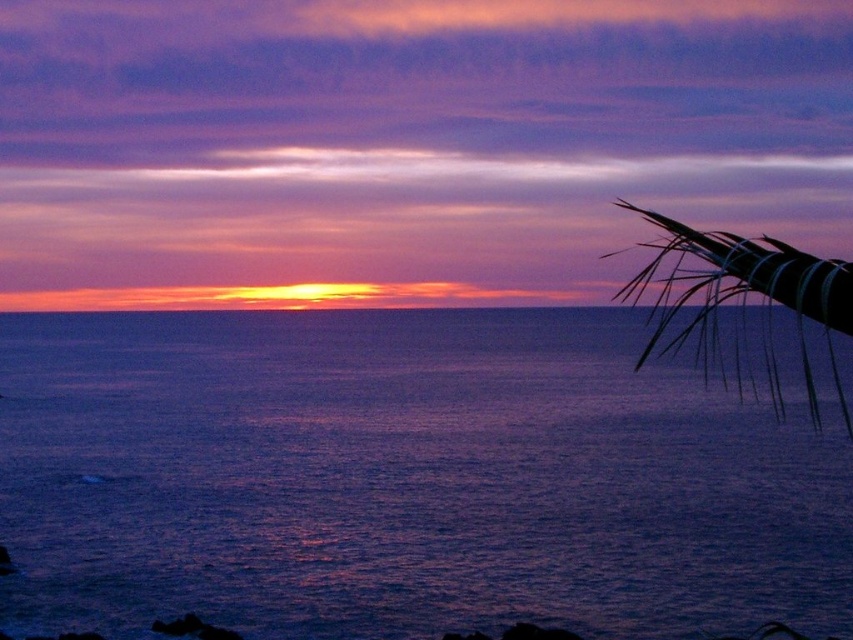
You are a photographer trying to capture the sunset. You notice the purple water at center and the silvery metallic palm fronds at upper right. Which object is closer to your camera lens?

The purple water at center is closer to the camera lens because it is further to the viewer than the silvery metallic palm fronds at upper right, meaning it appears in front of the palm fronds in the scene.

You are standing at the point closest to the camera in the image. There are two points marked in the scene, point 1 at coordinates point [73,336] and point 2 at point [688,248]. Which point is closer to your current position?

Point 1 at coordinates point [73,336] is further to the camera than point 2 at point [688,248], so the point closer to your current position would be point 2 at point [688,248].